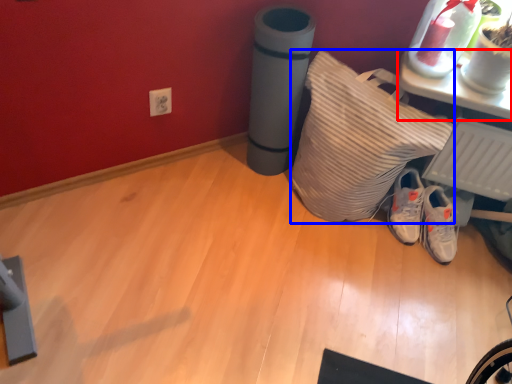
Question: Which object appears closest to the camera in this image, furniture (highlighted by a red box) or pillow (highlighted by a blue box)?

Choices:
 (A) furniture
 (B) pillow

Answer: (B)